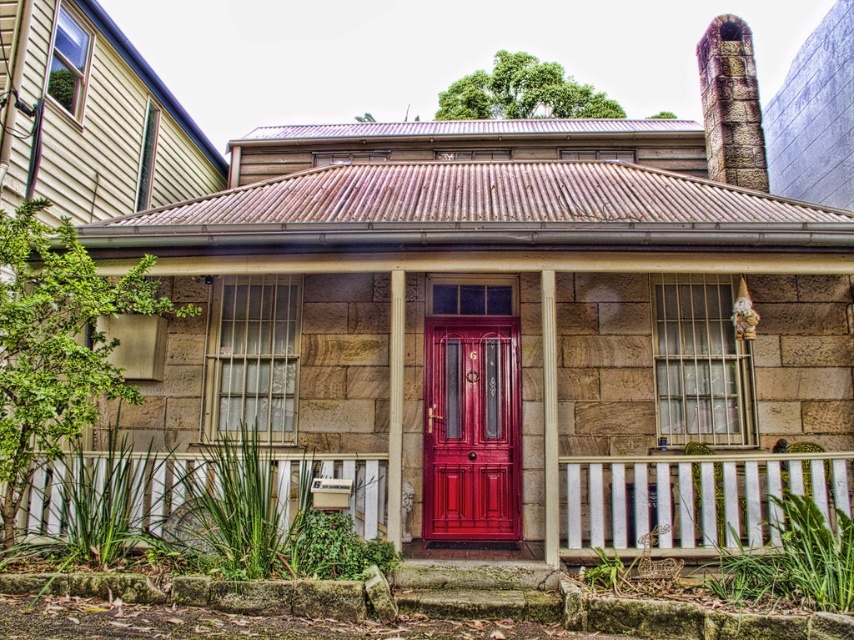
Question: Is smooth wooden porch at center closer to camera compared to glossy wood door at center?

Choices:
 (A) no
 (B) yes

Answer: (B)

Question: Among these points, which one is farthest from the camera?

Choices:
 (A) (430, 426)
 (B) (816, 460)

Answer: (A)

Question: Can you confirm if smooth wooden porch at center is bigger than glossy wood door at center?

Choices:
 (A) yes
 (B) no

Answer: (B)

Question: Which point is farther to the camera?

Choices:
 (A) glossy wood door at center
 (B) smooth wooden porch at center

Answer: (A)

Question: Can you confirm if smooth wooden porch at center is positioned to the left of glossy wood door at center?

Choices:
 (A) yes
 (B) no

Answer: (B)

Question: Which object is closer to the camera taking this photo?

Choices:
 (A) glossy wood door at center
 (B) smooth wooden porch at center

Answer: (B)